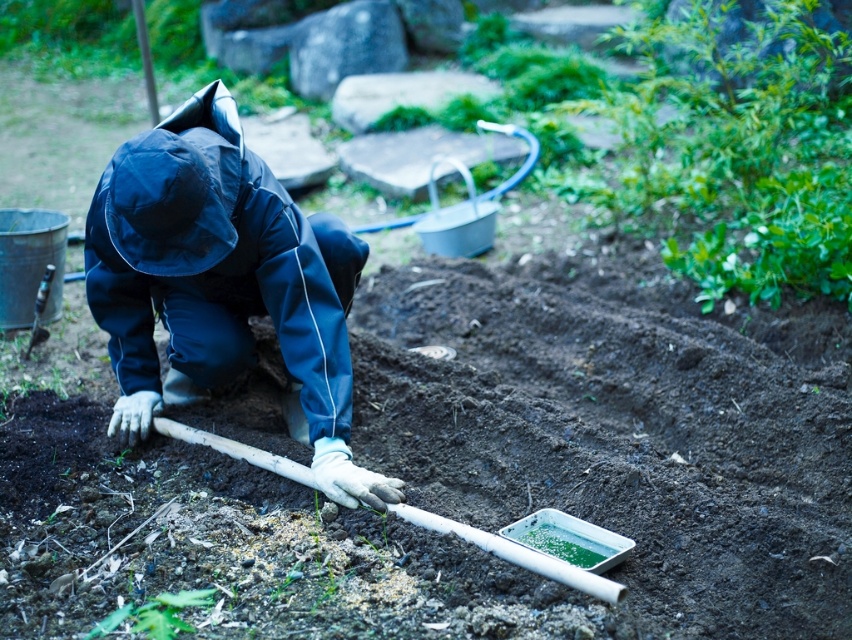
Question: Does dark brown soil at center appear on the right side of navy blue waterproof suit at center?

Choices:
 (A) yes
 (B) no

Answer: (A)

Question: Is dark brown soil at center positioned in front of navy blue waterproof suit at center?

Choices:
 (A) no
 (B) yes

Answer: (B)

Question: Is dark brown soil at center closer to camera compared to navy blue waterproof suit at center?

Choices:
 (A) yes
 (B) no

Answer: (A)

Question: Which point is closer to the camera taking this photo?

Choices:
 (A) (491, 353)
 (B) (346, 228)

Answer: (B)